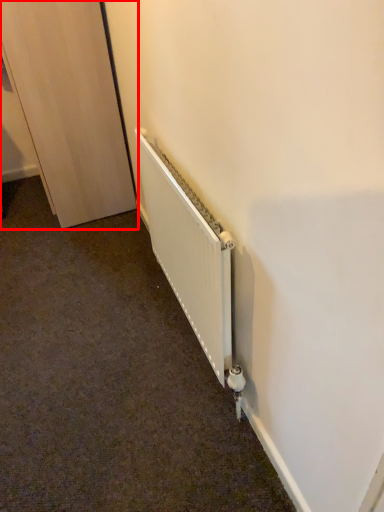
Question: From the image's perspective, what is the correct spatial positioning of door (annotated by the red box) in reference to radiator?

Choices:
 (A) below
 (B) above

Answer: (B)